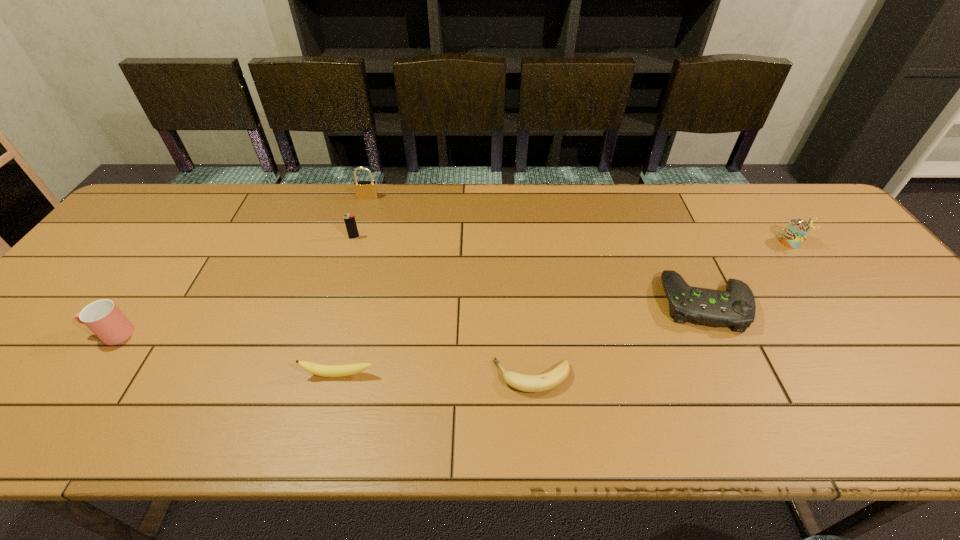
Locate an element on the screen. This screenshot has height=540, width=960. free spot located 0.220m on the back of the igniter is located at coordinates (368, 192).

Where is `vacant space located 0.220m on the left of the control`? The image size is (960, 540). vacant space located 0.220m on the left of the control is located at coordinates (x=574, y=303).

This screenshot has height=540, width=960. I want to click on vacant position located on the upward curve of the taller banana, so click(332, 401).

At what (x,y) coordinates should I click in order to perform the action: click on vacant space located 0.290m at the stem of the right banana. Please return your answer as a coordinate pair (x, y). This screenshot has width=960, height=540. Looking at the image, I should click on (361, 377).

Locate an element on the screen. This screenshot has width=960, height=540. vacant point located at the stem of the right banana is located at coordinates (328, 377).

Identify the location of vacant space located at the stem of the right banana. (320, 377).

Find the location of a particular element. The height and width of the screenshot is (540, 960). object that is at the far edge is located at coordinates (367, 190).

Find the location of a particular element. object that is at the left edge is located at coordinates (102, 317).

At what (x,y) coordinates should I click in order to perform the action: click on object located at the right edge. Please return your answer as a coordinate pair (x, y). This screenshot has height=540, width=960. Looking at the image, I should click on (797, 230).

You are a GUI agent. You are given a task and a screenshot of the screen. Output one action in this format:
    pyautogui.click(x=<x>, y=<y>)
    Task: Click on the free space at the far edge of the desktop
    
    Given the screenshot: What is the action you would take?
    pyautogui.click(x=478, y=184)